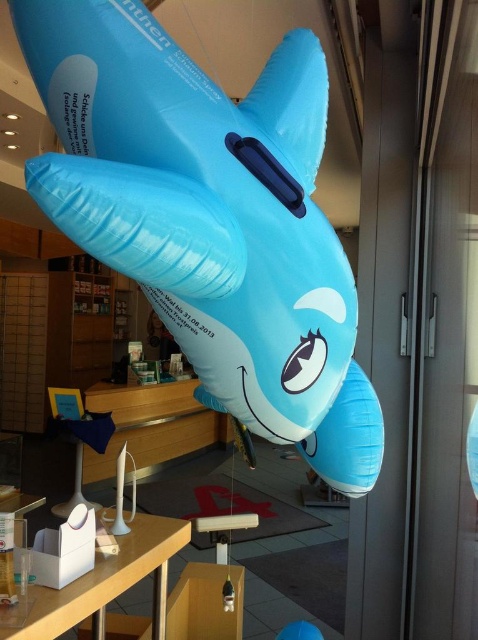
You are a customer entering the store and see the blue inflatable dolphin at center and the white plastic table at lower center. Which object is closer to you?

The blue inflatable dolphin at center is closer to you because it is in front of the white plastic table at lower center.

You are a customer in a store and see both the blue inflatable dolphin at center and the blue rubber dolphin at center. Which one is placed higher?

The blue inflatable dolphin at center is positioned over the blue rubber dolphin at center, so it is placed higher.

You are organizing an event and need to decide which dolphin to place on a 1.2 meter tall stand. The blue inflatable dolphin at center and the blue rubber dolphin at center are both options. Based on their heights, which one can fit better on the stand without exceeding the stand height?

The blue inflatable dolphin at center has a greater height compared to the blue rubber dolphin at center. Since the stand is 1.2 meters tall, the blue inflatable dolphin at center may exceed the stand height, while the blue rubber dolphin at center is shorter and would fit better without exceeding the stand height.